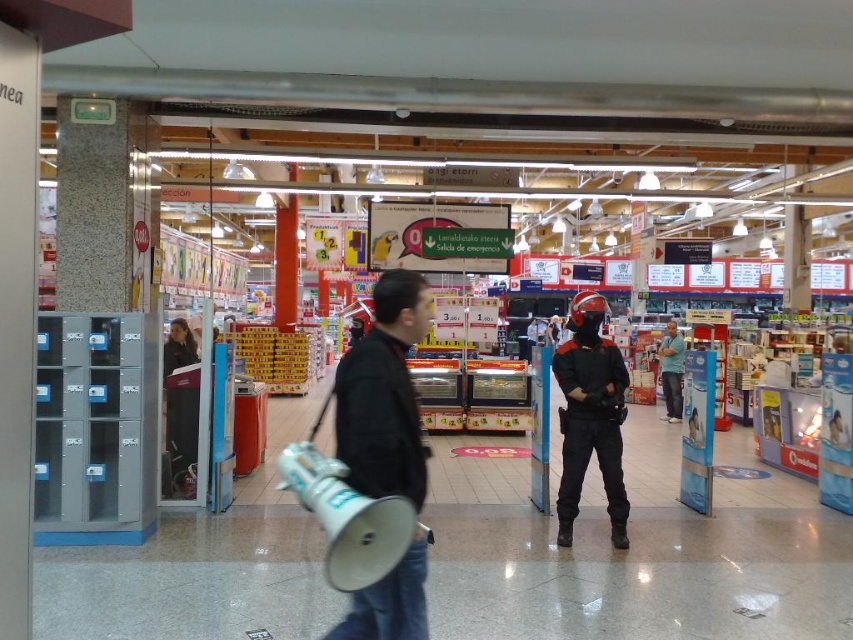
Can you confirm if black matte uniform at center is bigger than blue fabric shirt at center?

Actually, black matte uniform at center might be smaller than blue fabric shirt at center.

The height and width of the screenshot is (640, 853). Find the location of `black matte uniform at center`. black matte uniform at center is located at coordinates pos(590,416).

Which is more to the left, black matte megaphone at center or blue fabric shirt at center?

black matte megaphone at center is more to the left.

From the picture: Can you confirm if black matte megaphone at center is thinner than blue fabric shirt at center?

Incorrect, black matte megaphone at center's width is not less than blue fabric shirt at center's.

Where is `black matte megaphone at center`? This screenshot has height=640, width=853. black matte megaphone at center is located at coordinates (384, 394).

This screenshot has height=640, width=853. I want to click on black matte megaphone at center, so click(384, 394).

Does black matte megaphone at center have a lesser width compared to black matte uniform at center?

Yes, black matte megaphone at center is thinner than black matte uniform at center.

Where is `black matte megaphone at center`? The height and width of the screenshot is (640, 853). black matte megaphone at center is located at coordinates (384, 394).